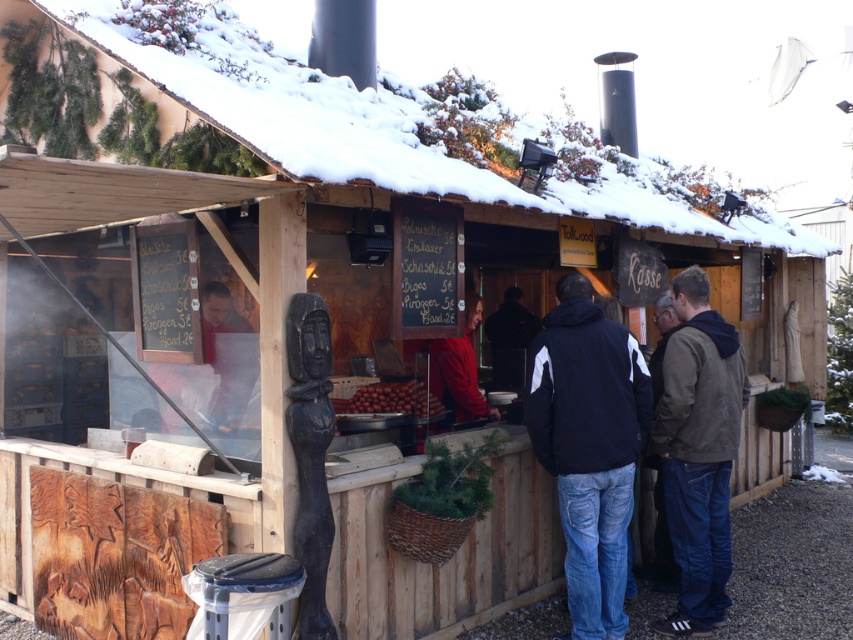
You are a customer at the food stall and want to order the item listed on the menu board. You notice the black fabric jacket at center and the brown matte nuts at center. Which object is closer to the right edge of the menu board?

The black fabric jacket at center is positioned on the right side of brown matte nuts at center, so it is closer to the right edge of the menu board.

You are a customer at the food stall and you want to point out the black fabric jacket at center and the brown matte nuts at center to a friend. Which one is bigger in size?

The black fabric jacket at center is larger in size than the brown matte nuts at center.